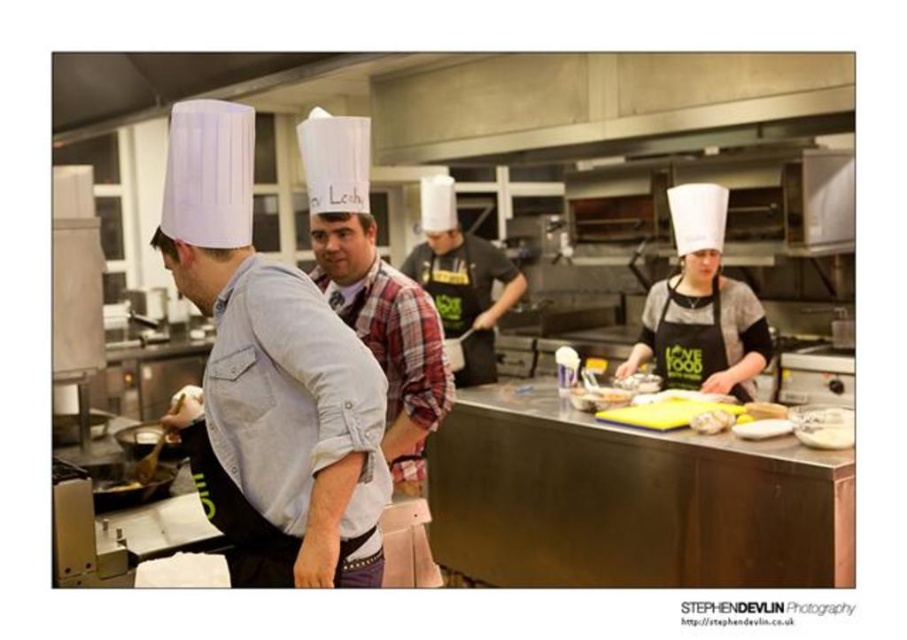
You are a food critic attending a cooking class and want to take a photo of the white creamy cheese at center without the black matte chef hat at center blocking the view. Can you move your camera position to achieve this?

The black matte chef hat at center is further to the viewer than the white creamy cheese at center, so moving your camera position behind the black matte chef hat at center would allow you to capture the white creamy cheese at center without obstruction.

In the commercial kitchen scene, there are three chefs wearing traditional white chef hats and aprons. The first chef on the left has a light blue shirt and black apron, the second chef in the center is wearing a red and white plaid shirt and dark apron, and the third chef on the right is not mentioned. The coordinates point at (461, 280) are given. Which chef is wearing the black matte chef hat at center?

The point at coordinates (461, 280) corresponds to the black matte chef hat at center, so the chef in the center is wearing it.